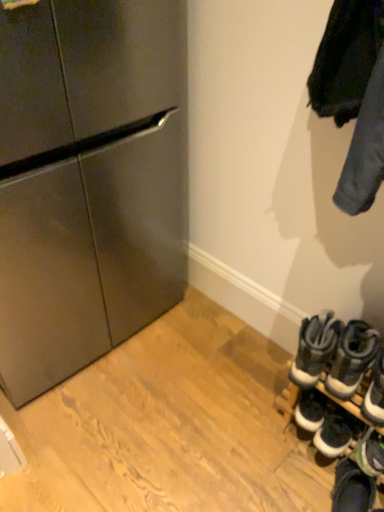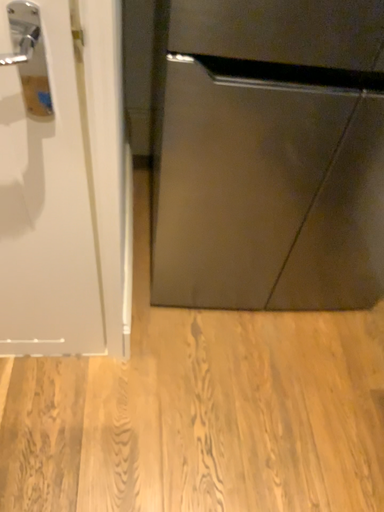
Question: Which way did the camera rotate in the video?

Choices:
 (A) rotated left
 (B) rotated right

Answer: (A)